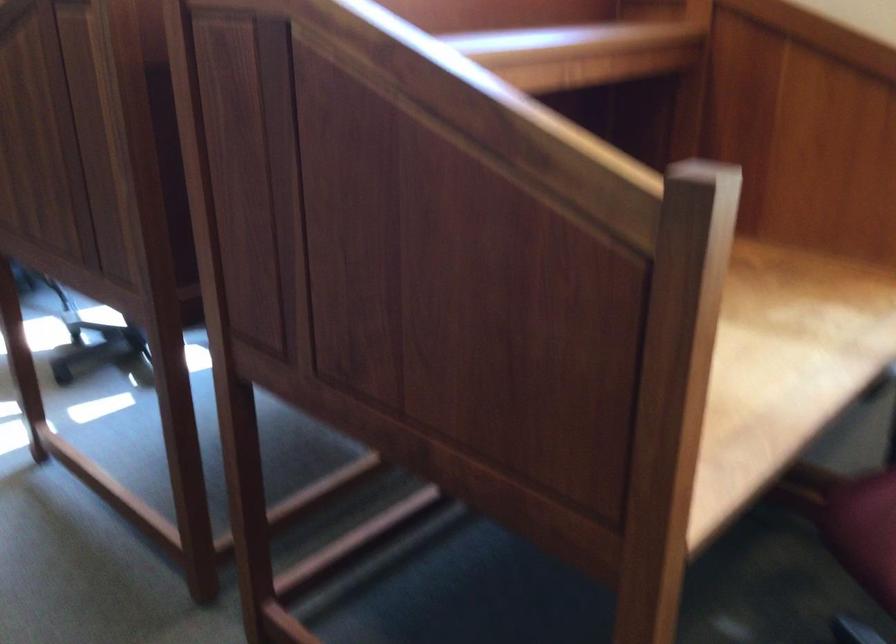
Question: Based on the continuous images, in which direction is the camera rotating? Reply with the corresponding letter.

Choices:
 (A) Left
 (B) Right
 (C) Up
 (D) Down

Answer: (B)